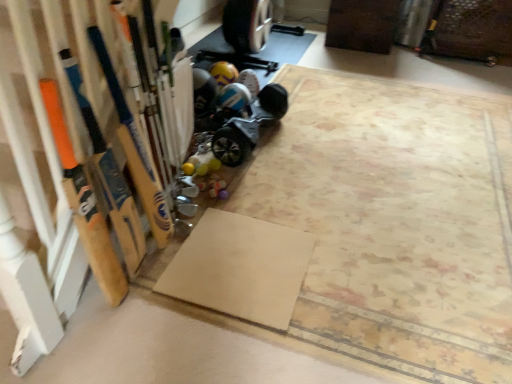
Where is `free space between blue metallic hoverboard at lower center and beige matte yoga mat at lower center`? The height and width of the screenshot is (384, 512). free space between blue metallic hoverboard at lower center and beige matte yoga mat at lower center is located at coordinates (262, 185).